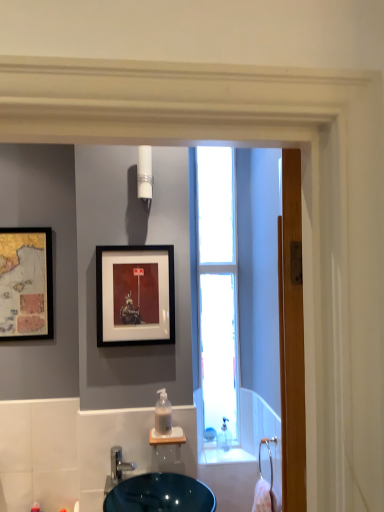
Question: Is point (200, 216) positioned closer to the camera than point (107, 490)?

Choices:
 (A) closer
 (B) farther

Answer: (B)

Question: Would you say transparent glass window at center is to the left or to the right of satin nickel faucet at lower center in the picture?

Choices:
 (A) left
 (B) right

Answer: (B)

Question: Which object is the farthest from the matte black picture frame at center, arranged as the 1th picture frame when viewed from the right?

Choices:
 (A) clear plastic soap dispenser at center
 (B) transparent glass window at center
 (C) gold metallic map at left, which is the 2th picture frame in right-to-left order
 (D) white glossy light fixture at upper center
 (E) satin nickel faucet at lower center

Answer: (E)

Question: Estimate the real-world distances between objects in this image. Which object is closer to the transparent glass window at center?

Choices:
 (A) wooden screen door at right
 (B) white glossy light fixture at upper center
 (C) clear plastic soap dispenser at center
 (D) gold metallic map at left, the second picture frame from the front
 (E) satin nickel faucet at lower center

Answer: (A)